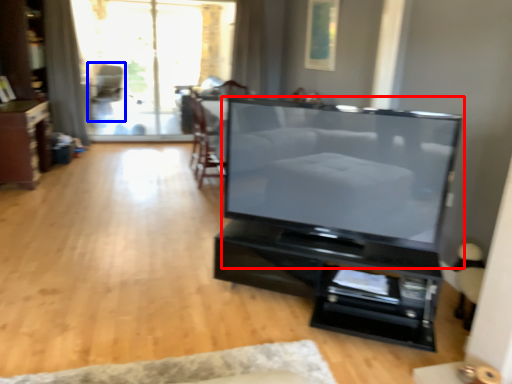
Question: Which point is closer to the camera, television (highlighted by a red box) or armchair (highlighted by a blue box)?

Choices:
 (A) television
 (B) armchair

Answer: (A)